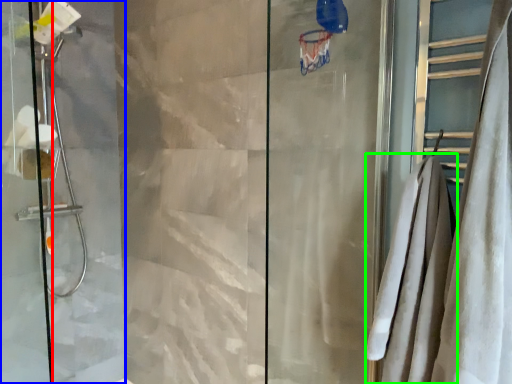
Question: Which object is the farthest from screen door (highlighted by a red box)? Choose among these: screen door (highlighted by a blue box) or bath towel (highlighted by a green box).

Choices:
 (A) screen door
 (B) bath towel

Answer: (B)